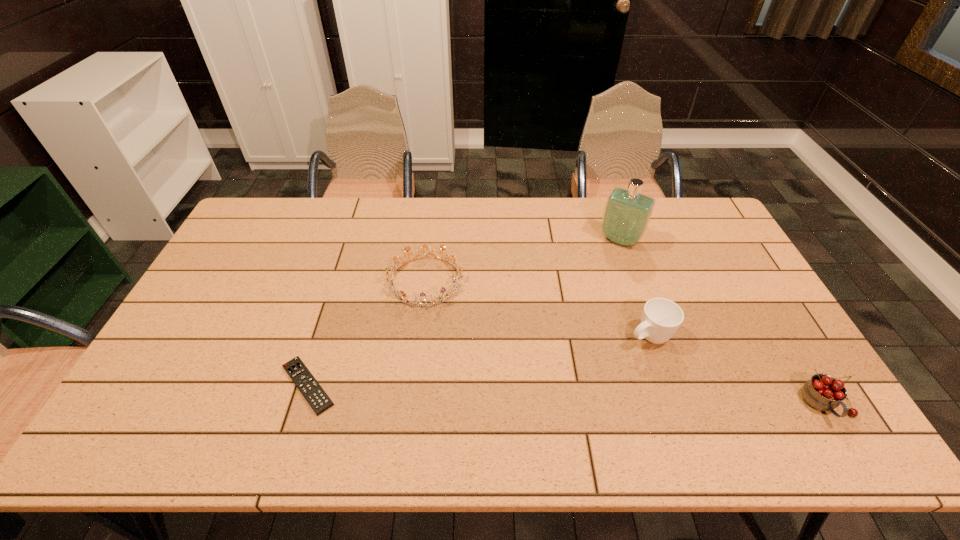
Identify which object is the third closest to the rightmost object. Please provide its 2D coordinates. Your answer should be formatted as a tuple, i.e. [(x, y)], where the tuple contains the x and y coordinates of a point satisfying the conditions above.

[(457, 279)]

Identify the location of free location that satisfies the following two spatial constraints: 1. on the back side of the perfume; 2. on the right side of the tiara. The width and height of the screenshot is (960, 540). (430, 240).

Find the location of a particular element. free space that satisfies the following two spatial constraints: 1. on the front side of the tiara; 2. on the left side of the cup is located at coordinates (419, 336).